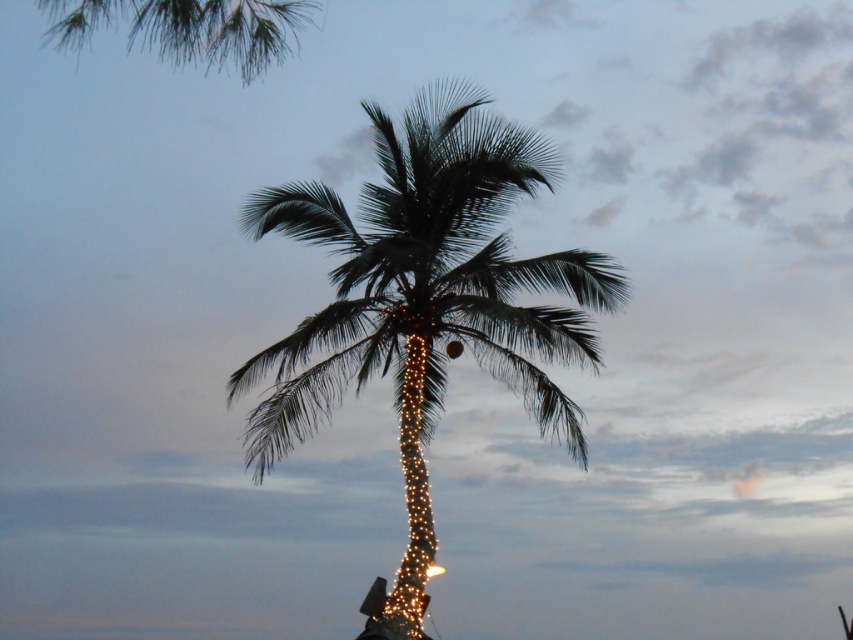
You are an artist planning to paint the palm trees in the twilight scene. You want to ensure the size relationship between the green leafy palm tree at center and the green leafy palm at upper left is accurate. Which one should you depict as larger?

The green leafy palm at upper left should be depicted as larger since the green leafy palm tree at center is smaller than it.

You are a photographer planning to capture the two green leafy palm trees in the scene. Given that the green leafy palm tree at center and the green leafy palm at upper left are both in view, which one appears narrower in the photo?

The green leafy palm tree at center appears narrower in the photo because its width is less than the green leafy palm at upper left.

You are standing at the center of the image. Which direction should you move to get closer to the green leafy palm tree at center?

Since the green leafy palm tree at center is already at the center of the image, you don not need to move in any direction to get closer to it.